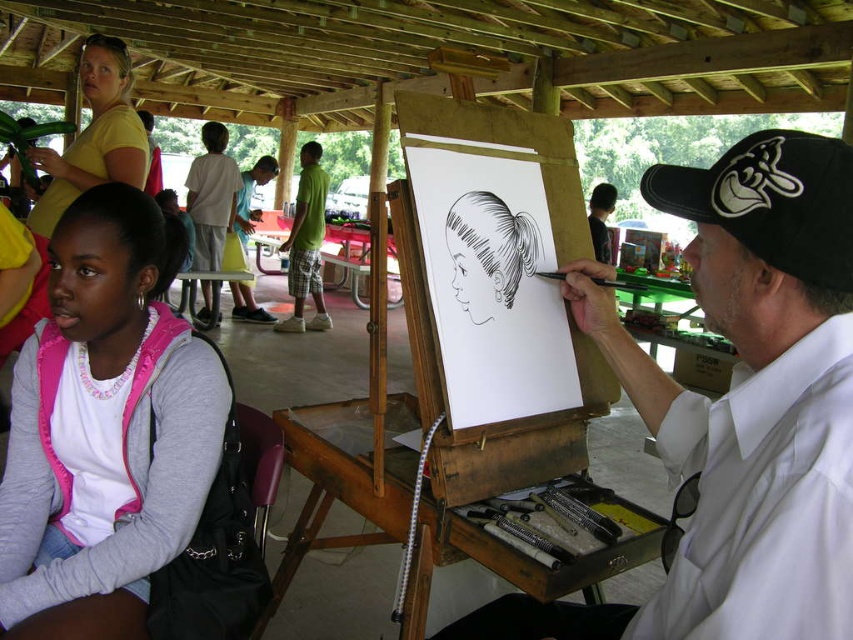
Question: From the image, what is the correct spatial relationship of wooden easel at center in relation to green cotton shirt at center?

Choices:
 (A) right
 (B) left

Answer: (A)

Question: Is wooden easel at center above smooth black cap at upper right?

Choices:
 (A) no
 (B) yes

Answer: (A)

Question: In this image, where is white shirt at center located relative to pink fleece jacket at lower left?

Choices:
 (A) right
 (B) left

Answer: (A)

Question: Which point appears closest to the camera in this image?

Choices:
 (A) (82, 221)
 (B) (610, 208)

Answer: (A)

Question: Which of these objects is positioned farthest from the pink fleece jacket at lower left?

Choices:
 (A) green cotton shirt at center
 (B) light green t-shirt at center

Answer: (A)

Question: Which object is positioned farthest from the green cotton shirt at center?

Choices:
 (A) wooden easel at center
 (B) white shirt at center
 (C) green cotton shorts at center

Answer: (B)